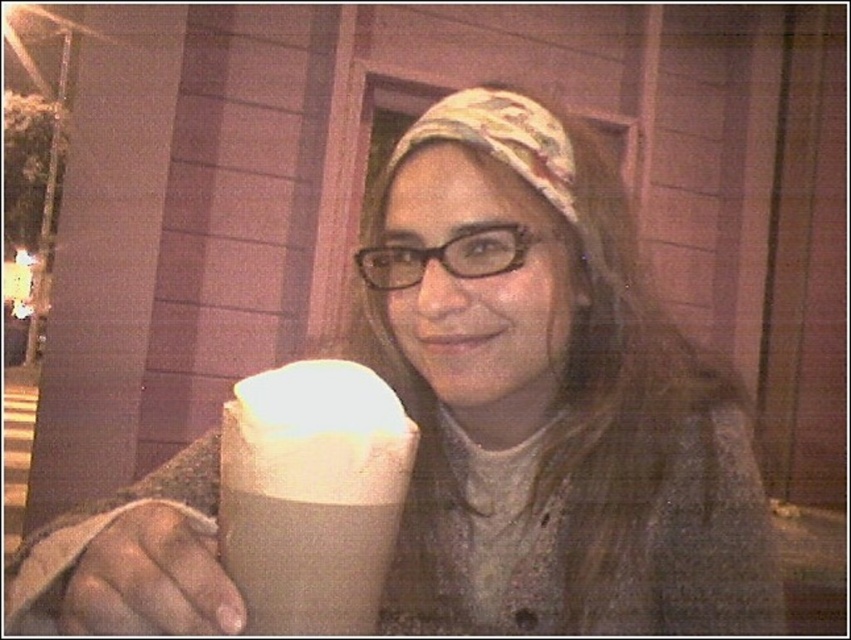
You are a photographer trying to capture the scene. The smooth beige hand at lower left and the patterned fabric headscarf at center are both in your frame. Based on their positions, which object is closer to the left edge of the photo?

The smooth beige hand at lower left is closer to the left edge of the photo because it is positioned to the left of the patterned fabric headscarf at center.

You are an architect designing a new coffee shop layout. You need to place a new table exactly at the coordinates where the white paper cup at center is located. What are the coordinates where you should place the table?

The coordinates for the white paper cup at center are at point (312, 493), so you should place the table at those coordinates.